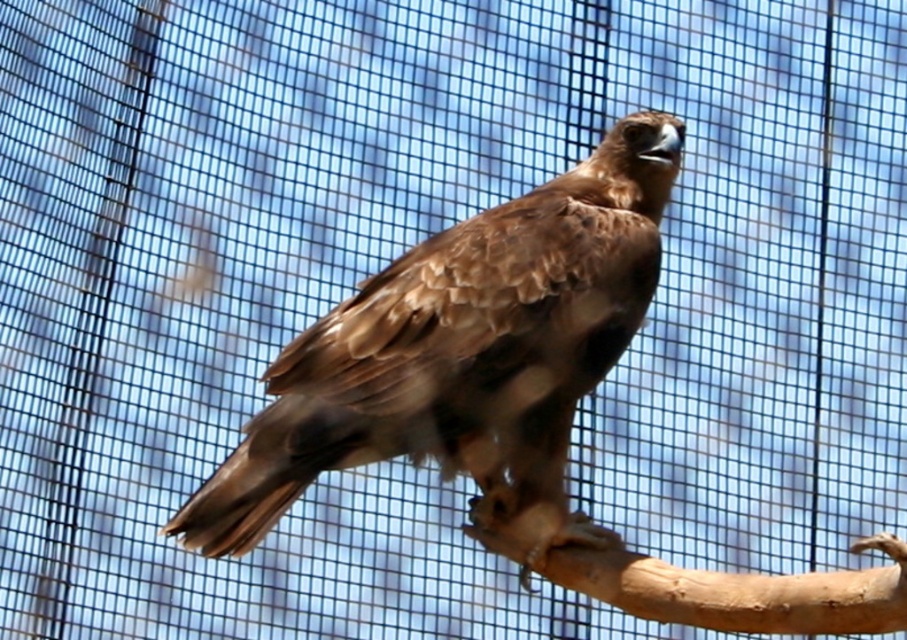
Can you confirm if brown feathered eagle at center is shorter than smooth brown wood at lower center?

No.

Is point (454, 445) behind point (512, 524)?

No, (454, 445) is in front of (512, 524).

Locate an element on the screen. This screenshot has width=907, height=640. brown feathered eagle at center is located at coordinates (465, 355).

Where is `brown feathered eagle at center`? This screenshot has width=907, height=640. brown feathered eagle at center is located at coordinates (465, 355).